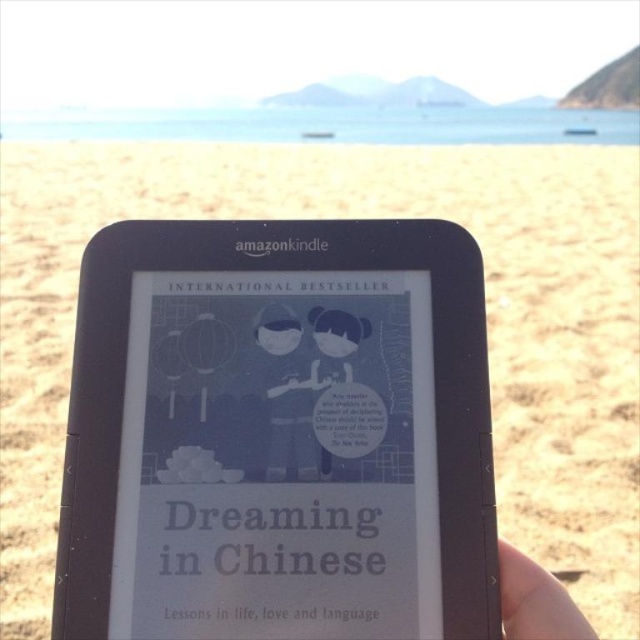
You are a photographer standing 1 meter away from a smooth skin hand at lower right. You want to take a closeup photo of the hand. Do you need to move closer or farther away?

The smooth skin hand at lower right is currently 53.85 centimeters away from the camera. Since you are standing 1 meter away, you need to move closer to get a closeup photo.

You are holding a Kindle e reader and see the smooth skin hand at lower right and the matte blue character at center. Which object is positioned more to the right side?

The smooth skin hand at lower right is positioned more to the right side than the matte blue character at center.